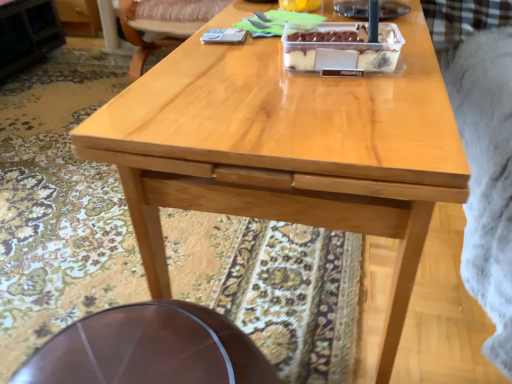
Question: Does shiny brown table at lower center have a smaller size compared to wooden chair at upper center?

Choices:
 (A) no
 (B) yes

Answer: (B)

Question: Is shiny brown table at lower center positioned in front of wooden chair at upper center?

Choices:
 (A) yes
 (B) no

Answer: (A)

Question: Is shiny brown table at lower center positioned with its back to wooden chair at upper center?

Choices:
 (A) yes
 (B) no

Answer: (B)

Question: From the image's perspective, is shiny brown table at lower center located beneath wooden chair at upper center?

Choices:
 (A) no
 (B) yes

Answer: (B)

Question: Considering the relative sizes of shiny brown table at lower center and wooden chair at upper center in the image provided, is shiny brown table at lower center bigger than wooden chair at upper center?

Choices:
 (A) yes
 (B) no

Answer: (B)

Question: Can you confirm if shiny brown table at lower center is wider than wooden chair at upper center?

Choices:
 (A) no
 (B) yes

Answer: (A)

Question: From a real-world perspective, is translucent plastic container at center located beneath shiny brown table at lower center?

Choices:
 (A) yes
 (B) no

Answer: (B)

Question: From the image's perspective, is translucent plastic container at center beneath shiny brown table at lower center?

Choices:
 (A) no
 (B) yes

Answer: (A)

Question: Does translucent plastic container at center have a larger size compared to shiny brown table at lower center?

Choices:
 (A) yes
 (B) no

Answer: (B)

Question: Is translucent plastic container at center thinner than shiny brown table at lower center?

Choices:
 (A) no
 (B) yes

Answer: (B)

Question: Can you confirm if translucent plastic container at center is shorter than shiny brown table at lower center?

Choices:
 (A) yes
 (B) no

Answer: (A)

Question: Is translucent plastic container at center at the right side of shiny brown table at lower center?

Choices:
 (A) yes
 (B) no

Answer: (A)

Question: Would you say shiny brown table at lower center is a long distance from translucent plastic container at center?

Choices:
 (A) no
 (B) yes

Answer: (A)